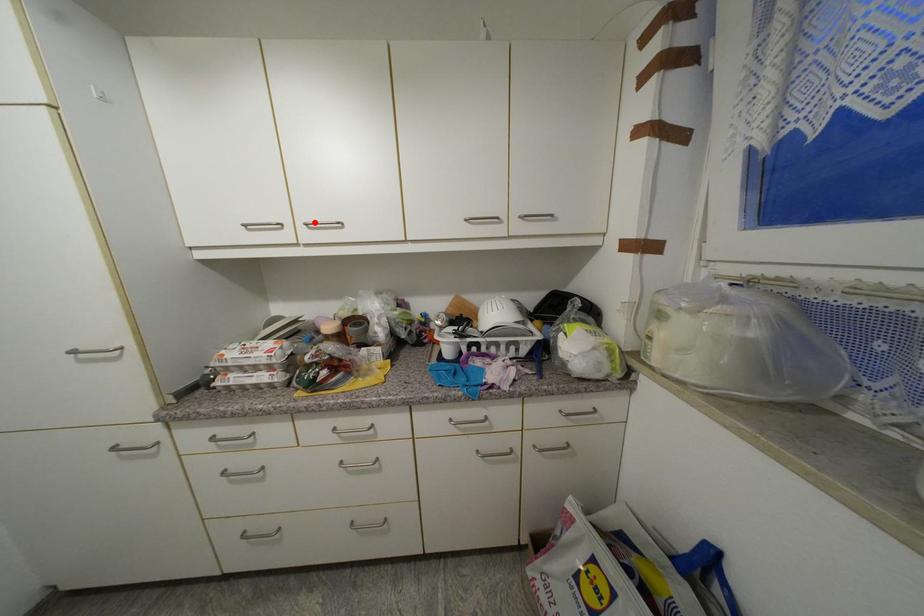
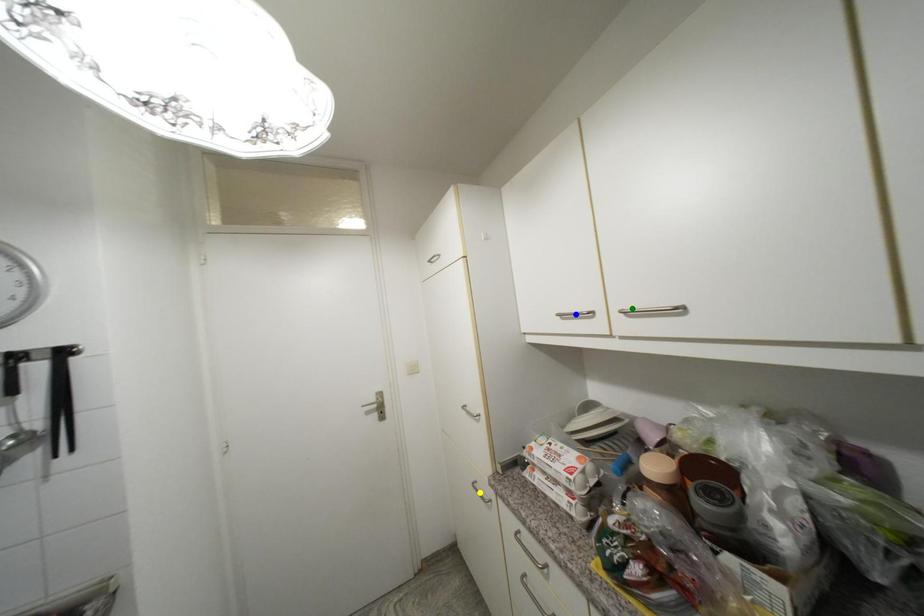
Question: I am providing you with two images of the same scene from different viewpoints. A red point is marked on the first image. You are given multiple points on the second image. Which point in image 2 represents the same 3d spot as the red point in image 1?

Choices:
 (A) yellow point
 (B) blue point
 (C) green point

Answer: (C)